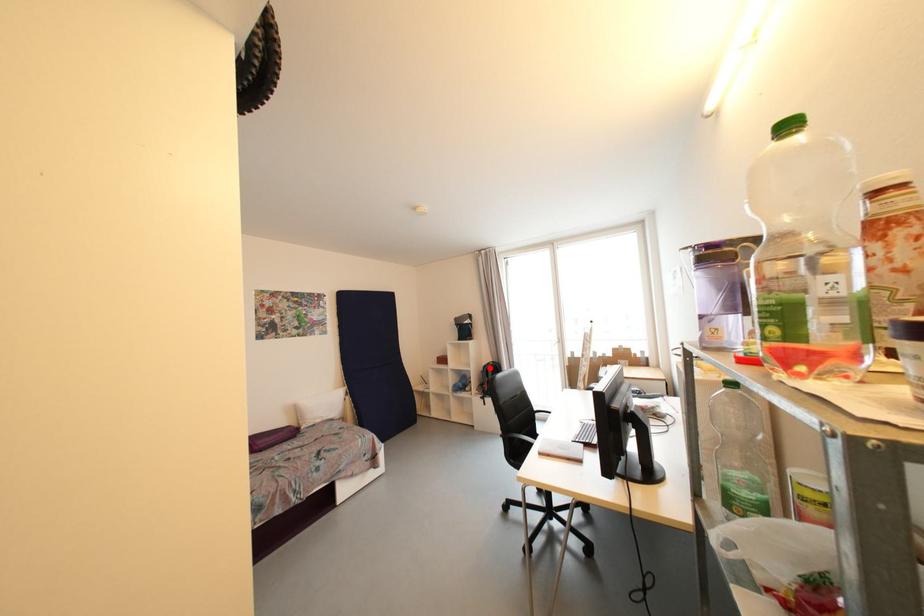
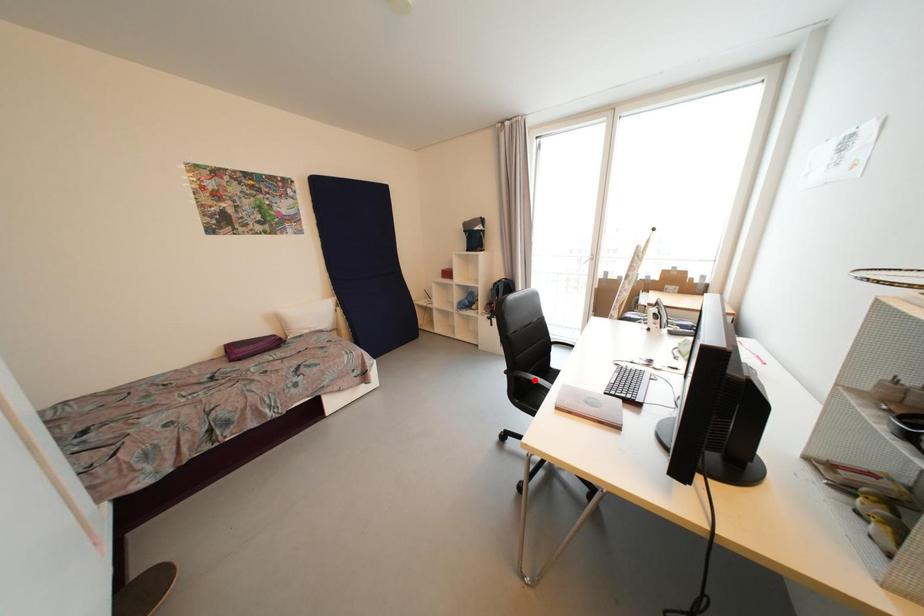
I am providing you with two images of the same scene from different viewpoints. A red point is marked on the first image and another point is marked on the second image. Does the point marked in image1 correspond to the same location as the one in image2?

No